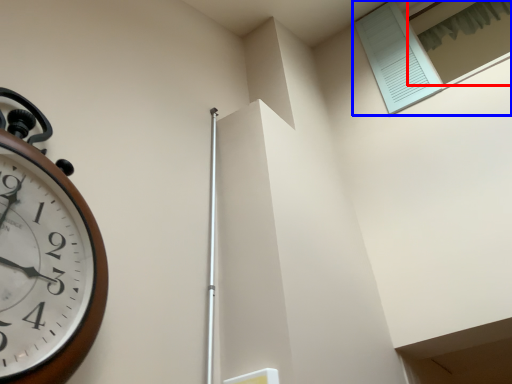
Question: Among these objects, which one is nearest to the camera, window (highlighted by a red box) or window (highlighted by a blue box)?

Choices:
 (A) window
 (B) window

Answer: (B)